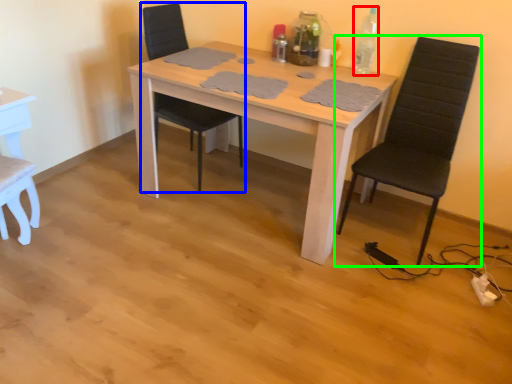
Question: Estimate the real-world distances between objects in this image. Which object is farther from bottle (highlighted by a red box), chair (highlighted by a blue box) or chair (highlighted by a green box)?

Choices:
 (A) chair
 (B) chair

Answer: (A)